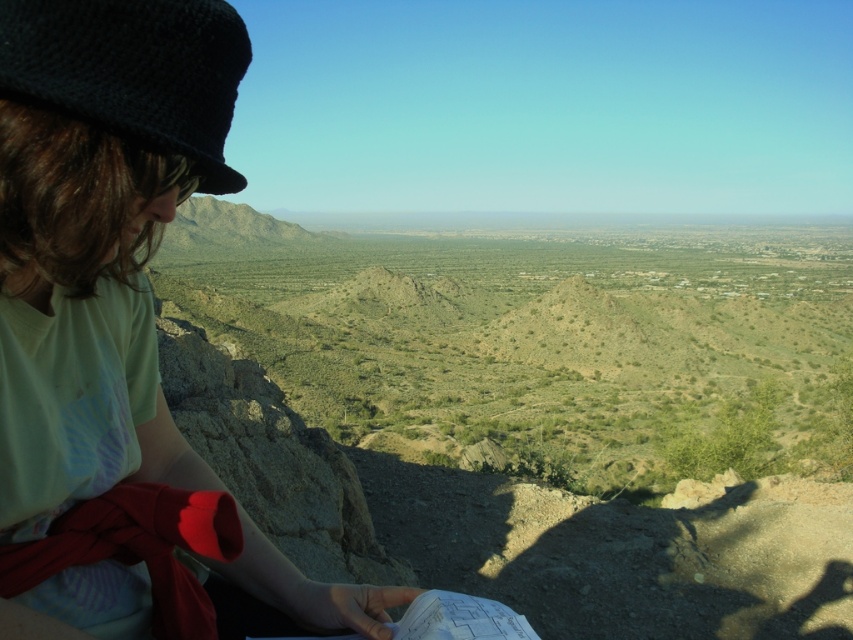
Can you confirm if matte black hat at upper left is shorter than black knitted hat at upper left?

Correct, matte black hat at upper left is not as tall as black knitted hat at upper left.

What do you see at coordinates (97, 234) in the screenshot? I see `matte black hat at upper left` at bounding box center [97, 234].

Find the location of `matte black hat at upper left`. matte black hat at upper left is located at coordinates pyautogui.click(x=97, y=234).